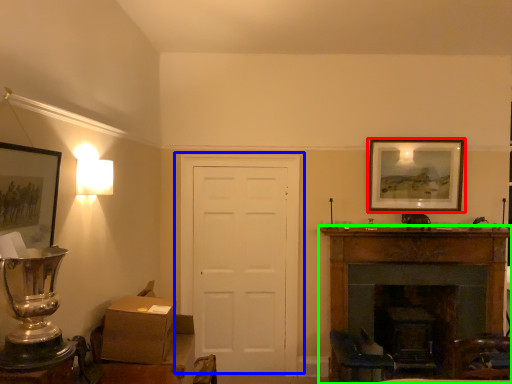
Question: Estimate the real-world distances between objects in this image. Which object is closer to picture frame (highlighted by a red box), door (highlighted by a blue box) or fireplace (highlighted by a green box)?

Choices:
 (A) door
 (B) fireplace

Answer: (B)